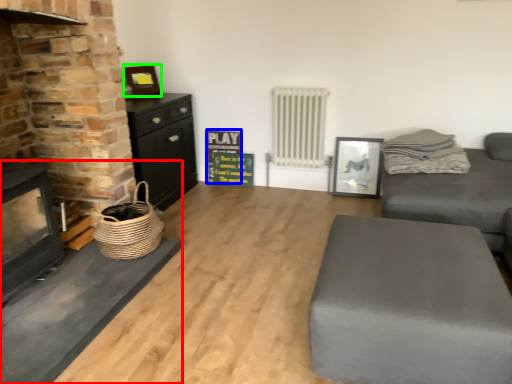
Question: Which object is the farthest from fireplace (highlighted by a red box)? Choose among these: bulletin board (highlighted by a blue box) or picture frame (highlighted by a green box).

Choices:
 (A) bulletin board
 (B) picture frame

Answer: (A)